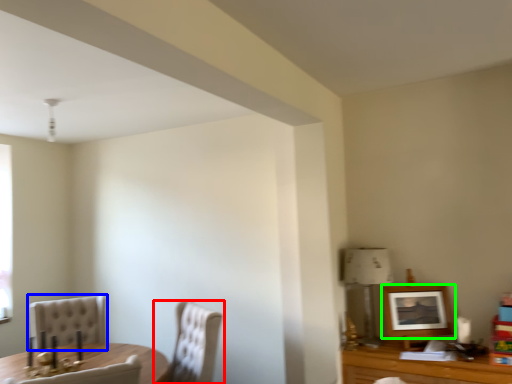
Question: Which is nearer to the chair (highlighted by a red box)? chair (highlighted by a blue box) or picture frame (highlighted by a green box).

Choices:
 (A) chair
 (B) picture frame

Answer: (A)